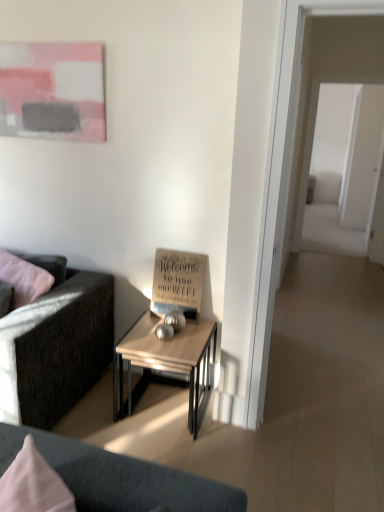
The width and height of the screenshot is (384, 512). I want to click on free space underneath wooden table at center (from a real-world perspective), so click(x=160, y=404).